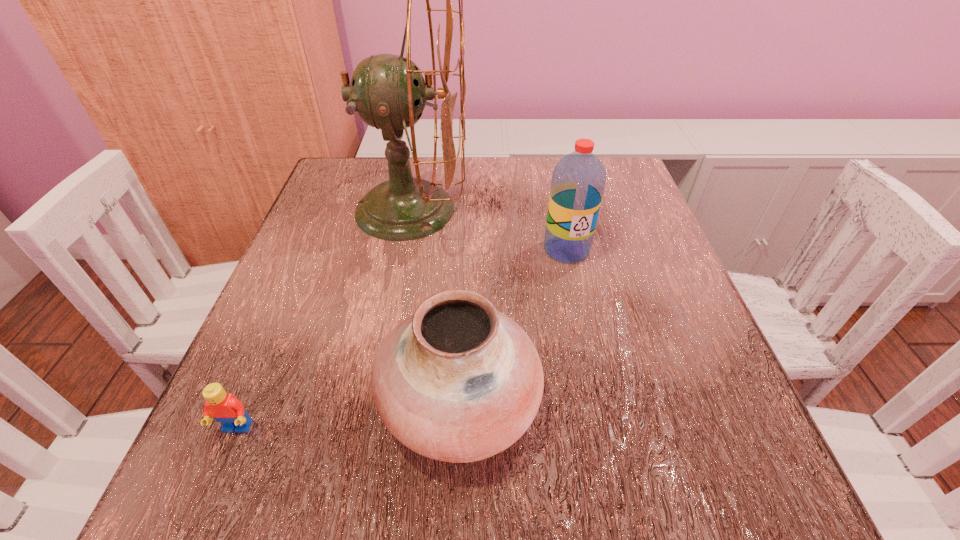
Where is `fan`? The height and width of the screenshot is (540, 960). fan is located at coordinates (388, 92).

Identify the location of the second tallest object. The height and width of the screenshot is (540, 960). (578, 181).

At what (x,y) coordinates should I click in order to perform the action: click on the rightmost object. Please return your answer as a coordinate pair (x, y). Looking at the image, I should click on (578, 181).

Locate an element on the screen. The image size is (960, 540). pottery is located at coordinates click(457, 381).

Find the location of a particular element. the shortest object is located at coordinates (223, 407).

This screenshot has height=540, width=960. I want to click on Lego, so [223, 407].

This screenshot has height=540, width=960. I want to click on vacant space positioned 0.150m in front of the fan, directing air flow, so click(x=534, y=210).

Identify the location of free space located on the front label of the water bottle. (588, 349).

Identify the location of free region located 0.330m on the back of the third tallest object. (467, 218).

Locate an element on the screen. free space located on the face of the Lego is located at coordinates (213, 485).